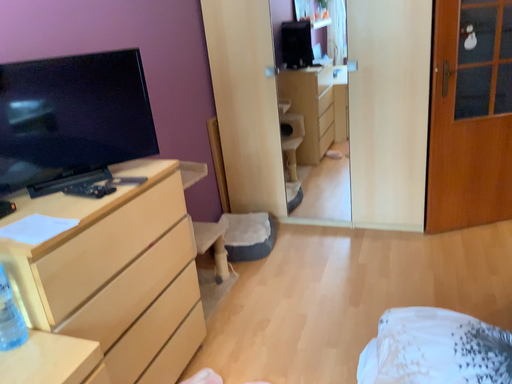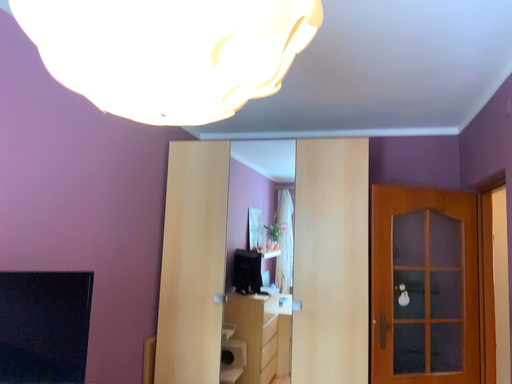
Question: Which way did the camera rotate in the video?

Choices:
 (A) rotated left
 (B) rotated right

Answer: (B)